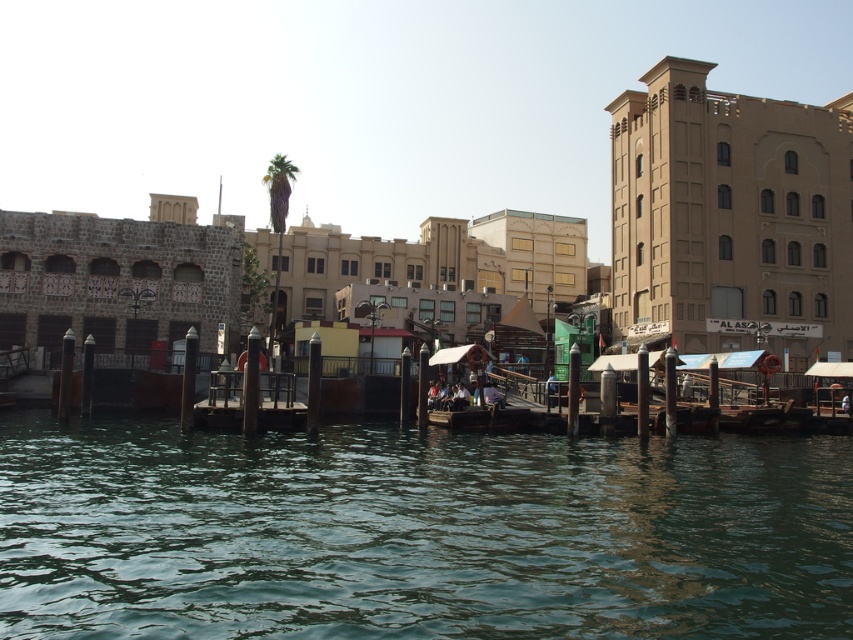
Question: Is greenish water at center positioned at the back of wooden boat at center?

Choices:
 (A) no
 (B) yes

Answer: (A)

Question: Is wooden dock at center smaller than wooden boat at center?

Choices:
 (A) yes
 (B) no

Answer: (A)

Question: Considering the relative positions of greenish water at center and stone textured hut at left in the image provided, where is greenish water at center located with respect to stone textured hut at left?

Choices:
 (A) above
 (B) below

Answer: (B)

Question: Which object appears farthest from the camera in this image?

Choices:
 (A) wooden dock at center
 (B) wooden boat at center
 (C) stone textured hut at left

Answer: (C)

Question: Which object is positioned closest to the wooden dock at center?

Choices:
 (A) wooden boat at center
 (B) stone textured hut at left
 (C) brown textured building at upper right

Answer: (A)

Question: Which object is closer to the camera taking this photo?

Choices:
 (A) wooden dock at center
 (B) stone textured hut at left
 (C) wooden boat at center
 (D) greenish water at center

Answer: (D)